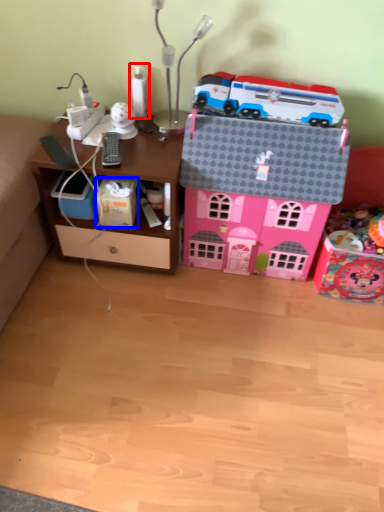
Question: Which point is further to the camera, toy (highlighted by a red box) or cardboard box (highlighted by a blue box)?

Choices:
 (A) toy
 (B) cardboard box

Answer: (A)